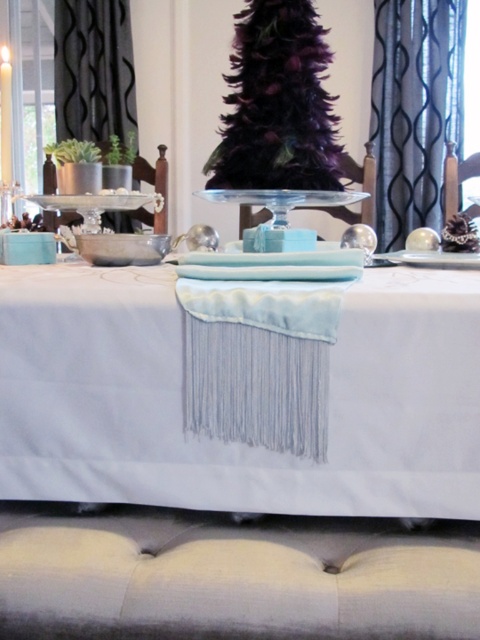
Question: Can you confirm if light blue fabric at center is positioned above satin blue curtain at upper right?

Choices:
 (A) yes
 (B) no

Answer: (B)

Question: Which point appears closest to the camera in this image?

Choices:
 (A) (255, 42)
 (B) (93, 353)
 (C) (99, 56)
 (D) (385, 122)

Answer: (B)

Question: Which of the following is the closest to the observer?

Choices:
 (A) satin blue curtain at upper right
 (B) dark purple feathered christmas tree at center
 (C) light blue fabric at center

Answer: (C)

Question: Can you confirm if light blue fabric at center is bigger than satin blue curtain at upper right?

Choices:
 (A) yes
 (B) no

Answer: (A)

Question: Does satin blue curtain at upper right come behind black textured curtain at left?

Choices:
 (A) no
 (B) yes

Answer: (A)

Question: Which point appears farthest from the camera in this image?

Choices:
 (A) (357, 340)
 (B) (451, 61)
 (C) (84, 26)

Answer: (C)